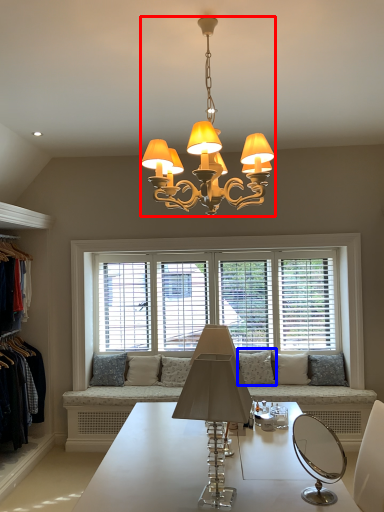
Question: Which object is further to the camera taking this photo, lamp (highlighted by a red box) or pillow (highlighted by a blue box)?

Choices:
 (A) lamp
 (B) pillow

Answer: (B)